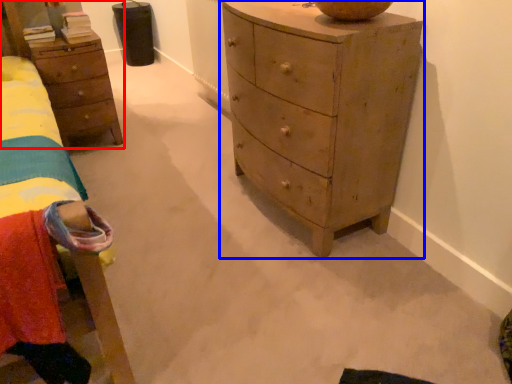
Question: Among these objects, which one is farthest to the camera, nightstand (highlighted by a red box) or chest of drawers (highlighted by a blue box)?

Choices:
 (A) nightstand
 (B) chest of drawers

Answer: (A)